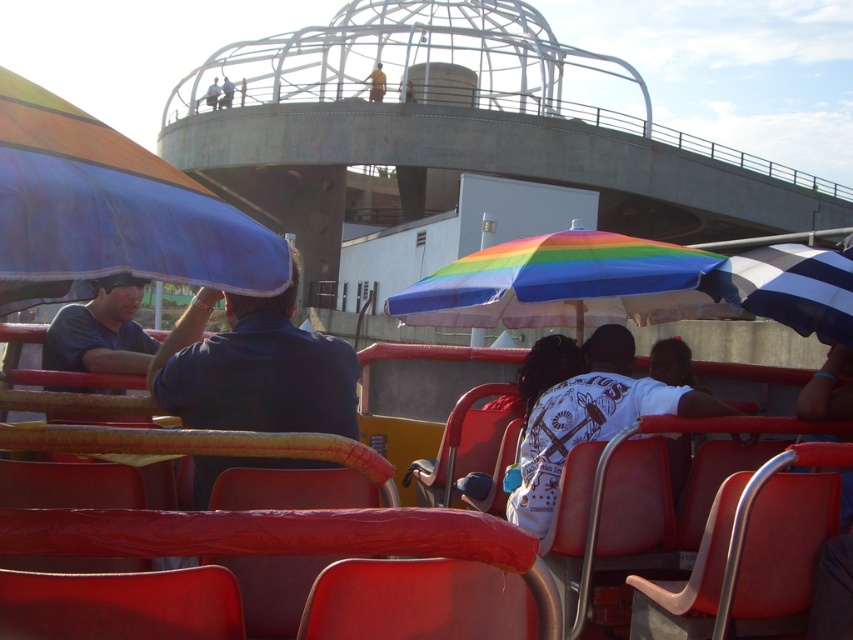
You are standing on the sightseeing tour boat and want to take a photo of both the red seats with metal handrails and the large modern structure in the background. Which point, point (9, 177) or point (109, 317), should you focus on to ensure both the foreground and background are in focus?

You should focus on point (109, 317) because it is farther from the viewer than point (9, 177), allowing both the foreground and background to be in focus.

You are a photographer trying to capture a clear shot of the white matte shirt at center and the yellow fabric umbrella at upper center. Since the umbrellas are colorful and large, you need to adjust your camera settings to ensure both subjects are in focus. Which object should you prioritize focusing on to account for their sizes?

The white matte shirt at center should be prioritized for focusing because its width is smaller than the yellow fabric umbrella at upper center, making it harder to capture clearly if not focused properly.